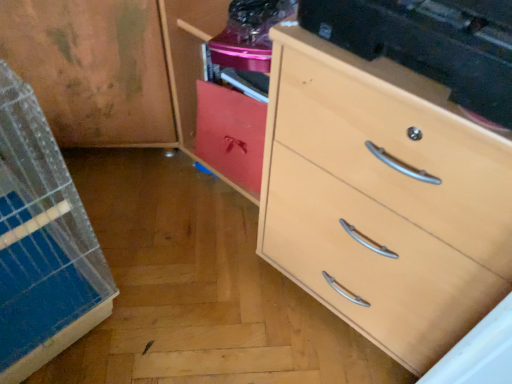
Question: Is point (220, 92) closer or farther from the camera than point (439, 142)?

Choices:
 (A) farther
 (B) closer

Answer: (A)

Question: From a real-world perspective, is matte red cabinet at center positioned above or below light wood chest of drawers at right?

Choices:
 (A) above
 (B) below

Answer: (B)

Question: Visually, is matte red cabinet at center positioned to the left or to the right of light wood chest of drawers at right?

Choices:
 (A) left
 (B) right

Answer: (A)

Question: Is light wood chest of drawers at right to the left or to the right of matte red cabinet at center in the image?

Choices:
 (A) left
 (B) right

Answer: (B)

Question: Is light wood chest of drawers at right in front of or behind matte red cabinet at center in the image?

Choices:
 (A) front
 (B) behind

Answer: (A)

Question: Is light wood chest of drawers at right inside or outside of matte red cabinet at center?

Choices:
 (A) inside
 (B) outside

Answer: (B)

Question: Considering the positions of point (507, 168) and point (249, 182), is point (507, 168) closer or farther from the camera than point (249, 182)?

Choices:
 (A) farther
 (B) closer

Answer: (B)